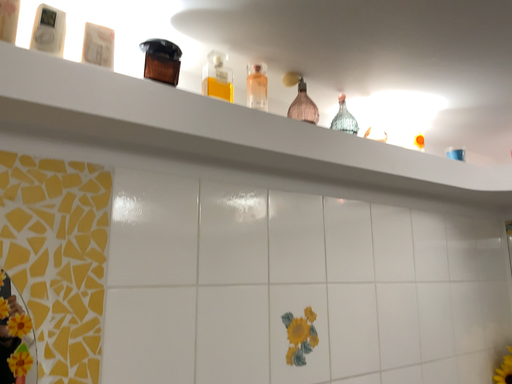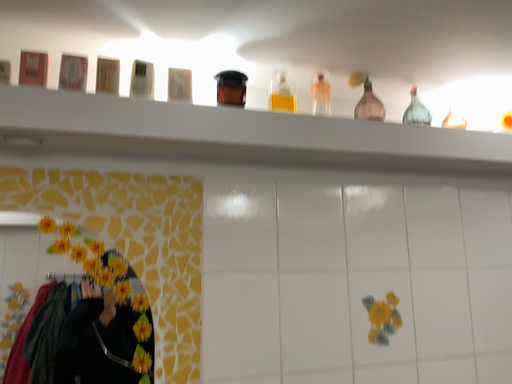
Question: How did the camera likely rotate when shooting the video?

Choices:
 (A) rotated right
 (B) rotated left

Answer: (B)